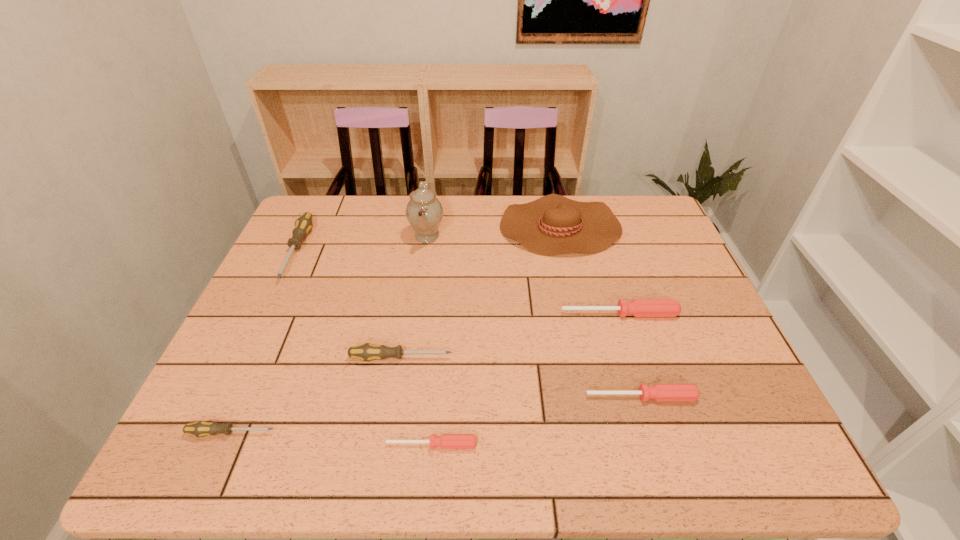
Find the location of a particular element. The image size is (960, 540). vacant space at the left edge of the desktop is located at coordinates (327, 248).

In the image, there is a desktop. Find the location of `blank space at the right edge`. blank space at the right edge is located at coordinates (743, 398).

Identify the location of vacant space at the far right corner of the desktop. (629, 234).

At what (x,y) coordinates should I click in order to perform the action: click on free space that is in between the smallest red screwdriver and the chinaware. Please return your answer as a coordinate pair (x, y). The height and width of the screenshot is (540, 960). Looking at the image, I should click on (429, 340).

Locate an element on the screen. Image resolution: width=960 pixels, height=540 pixels. vacant region between the smallest gray screwdriver and the biggest red screwdriver is located at coordinates (425, 373).

Identify the location of empty space that is in between the third nearest object and the nearest gray screwdriver. Image resolution: width=960 pixels, height=540 pixels. (437, 415).

This screenshot has width=960, height=540. Find the location of `vacant region between the fourth farthest object and the nearest gray screwdriver`. vacant region between the fourth farthest object and the nearest gray screwdriver is located at coordinates coord(425,373).

Where is `empty location between the fourth farthest object and the nearest gray screwdriver`? This screenshot has width=960, height=540. empty location between the fourth farthest object and the nearest gray screwdriver is located at coordinates (425, 373).

Identify the location of vacant region between the tallest object and the smallest gray screwdriver. [x=329, y=335].

Where is `vacant space that is in between the third nearest screwdriver and the smallest gray screwdriver`? The image size is (960, 540). vacant space that is in between the third nearest screwdriver and the smallest gray screwdriver is located at coordinates (437, 415).